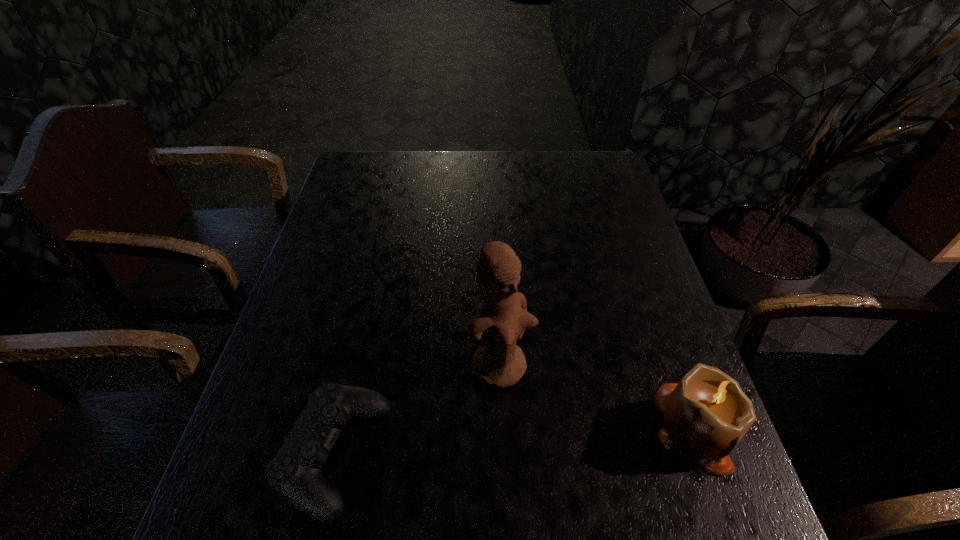
Locate an element on the screen. object at the near left corner is located at coordinates (294, 473).

The height and width of the screenshot is (540, 960). What are the coordinates of `object positioned at the near right corner` in the screenshot? It's located at pos(706,414).

The width and height of the screenshot is (960, 540). I want to click on free space at the far edge of the desktop, so click(x=477, y=154).

The image size is (960, 540). Find the location of `free space at the near edge of the desktop`. free space at the near edge of the desktop is located at coordinates (618, 446).

Where is `vacant space at the left edge of the desktop`? This screenshot has width=960, height=540. vacant space at the left edge of the desktop is located at coordinates (356, 281).

Identify the location of free spot at the right edge of the desktop. (648, 344).

You are a GUI agent. You are given a task and a screenshot of the screen. Output one action in this format:
    pyautogui.click(x=<x>, y=<y>)
    Task: Click on the free space at the far left corner of the desktop
    The image size is (960, 540).
    Given the screenshot: What is the action you would take?
    pyautogui.click(x=349, y=183)

Locate an element on the screen. The height and width of the screenshot is (540, 960). vacant space at the far right corner of the desktop is located at coordinates (588, 160).

Where is `vacant region between the shortest object and the candle`? This screenshot has height=540, width=960. vacant region between the shortest object and the candle is located at coordinates (530, 348).

This screenshot has height=540, width=960. Find the location of `free spot between the candle and the tallest object`. free spot between the candle and the tallest object is located at coordinates (599, 397).